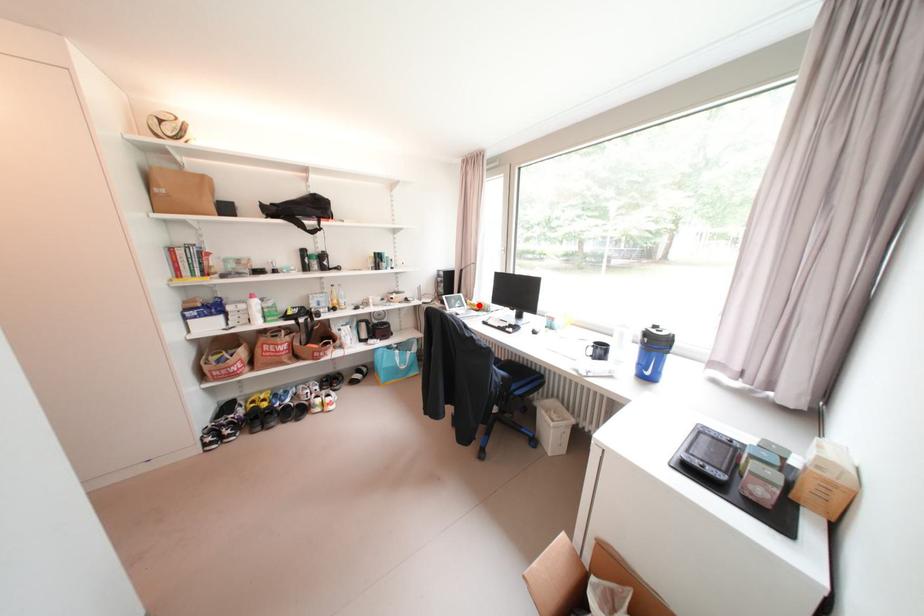
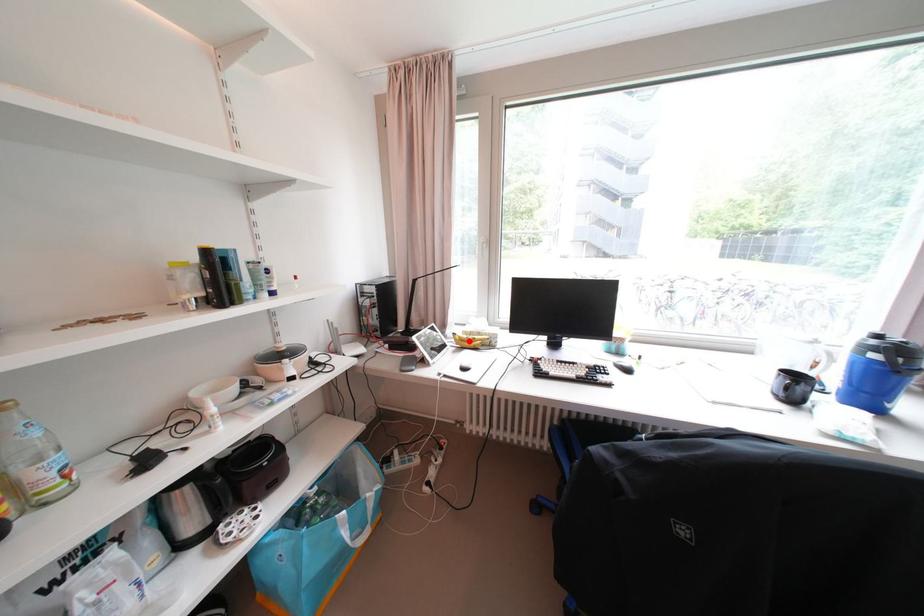
I am providing you with two images of the same scene from different viewpoints. A red point is marked on the first image and another point is marked on the second image. Are the points marked in image1 and image2 representing the same 3D position?

Yes